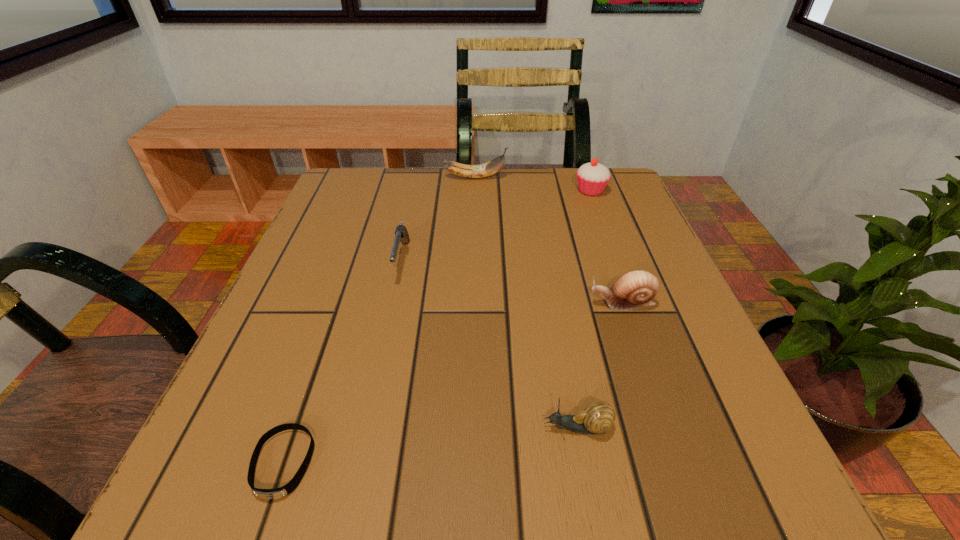
I want to click on empty location between the shortest object and the third nearest object, so click(453, 383).

Where is `free space between the farthest object and the shortest object`? free space between the farthest object and the shortest object is located at coordinates [x=379, y=320].

Locate an element on the screen. This screenshot has height=540, width=960. unoccupied position between the third object from left to right and the farther escargot is located at coordinates (548, 240).

The height and width of the screenshot is (540, 960). Identify the location of free space between the third object from left to right and the taller escargot. (548, 240).

Choose which object is the fourth nearest neighbor to the second shortest object. Please provide its 2D coordinates. Your answer should be formatted as a tuple, i.e. [(x, y)], where the tuple contains the x and y coordinates of a point satisfying the conditions above.

[(592, 178)]

Select which object is the fourth closest to the second object from left to right. Please provide its 2D coordinates. Your answer should be formatted as a tuple, i.e. [(x, y)], where the tuple contains the x and y coordinates of a point satisfying the conditions above.

[(598, 417)]

Locate an element on the screen. The image size is (960, 540). free space that satisfies the following two spatial constraints: 1. at the stem of the third object from left to right; 2. on the left side of the second farthest object is located at coordinates (475, 191).

At what (x,y) coordinates should I click in order to perform the action: click on vacant space that satisfies the following two spatial constraints: 1. on the front-facing side of the farther escargot; 2. on the display of the shortest object. Please return your answer as a coordinate pair (x, y). The width and height of the screenshot is (960, 540). Looking at the image, I should click on (677, 463).

The width and height of the screenshot is (960, 540). What are the coordinates of `vacant point that satisfies the following two spatial constraints: 1. at the stem of the fourth object from right to left; 2. on the right side of the second farthest object` in the screenshot? It's located at pyautogui.click(x=475, y=191).